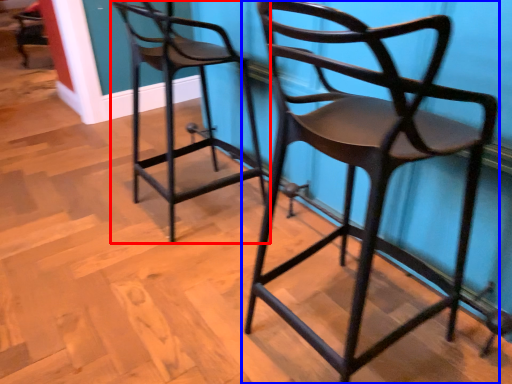
Question: Which object appears closest to the camera in this image, chair (highlighted by a red box) or chair (highlighted by a blue box)?

Choices:
 (A) chair
 (B) chair

Answer: (B)